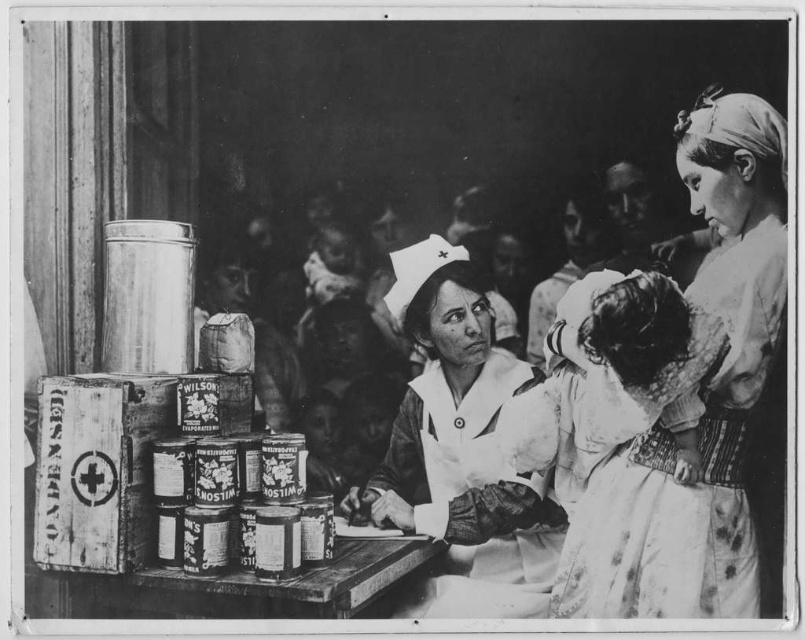
Who is shorter, white cotton dress at upper right or white cotton nurse uniform at center?

white cotton nurse uniform at center is shorter.

Is white cotton dress at upper right taller than white cotton nurse uniform at center?

Correct, white cotton dress at upper right is much taller as white cotton nurse uniform at center.

Is point (649, 461) positioned before point (402, 468)?

Yes, point (649, 461) is in front of point (402, 468).

Find the location of a particular element. The image size is (805, 640). white cotton dress at upper right is located at coordinates (700, 397).